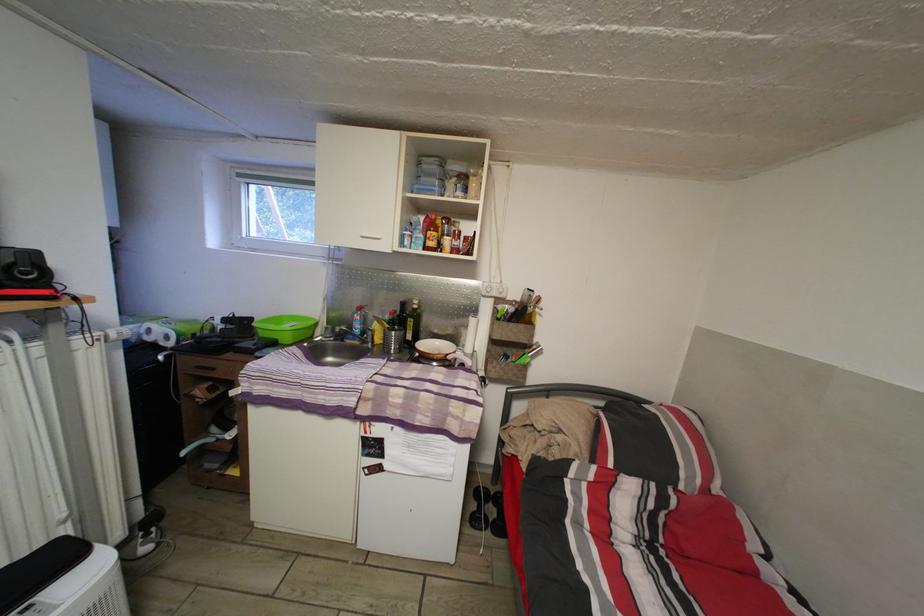
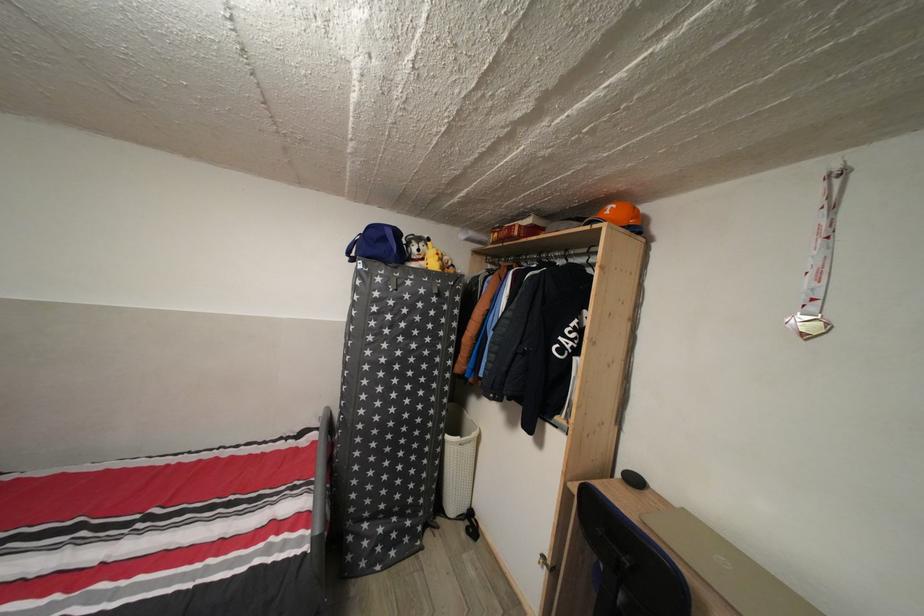
Question: The images are taken continuously from a first-person perspective. In which direction is your viewpoint rotating?

Choices:
 (A) Left
 (B) Right
 (C) Up
 (D) Down

Answer: (B)